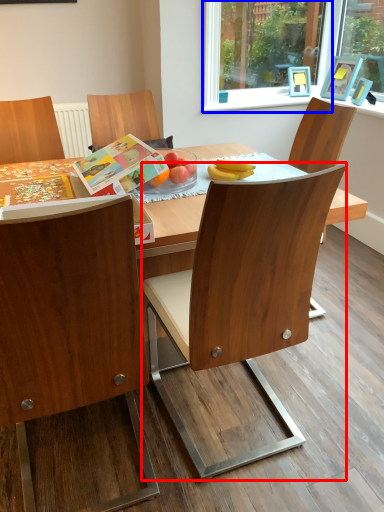
Question: Which object appears closest to the camera in this image, chair (highlighted by a red box) or window frame (highlighted by a blue box)?

Choices:
 (A) chair
 (B) window frame

Answer: (A)